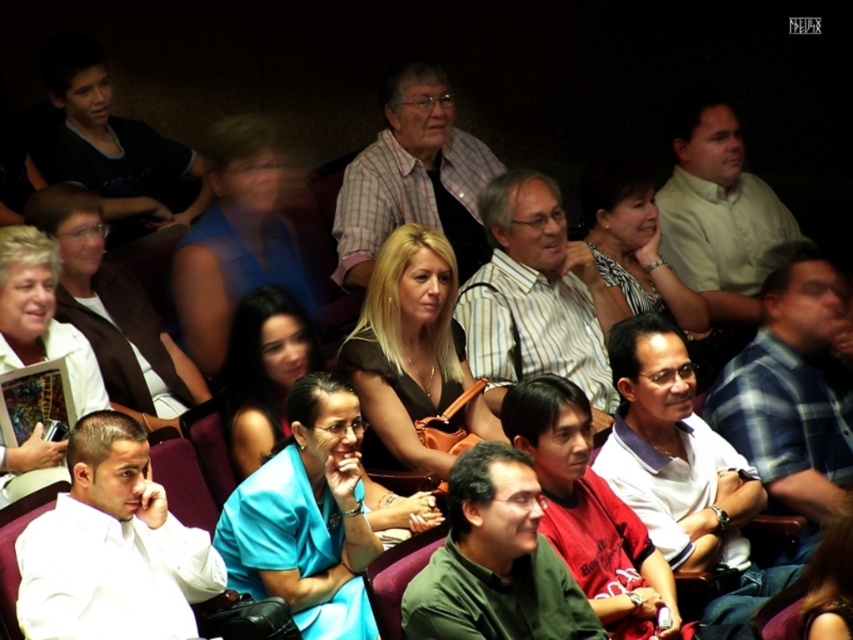
You are a photographer positioned at the back of the auditorium. You need to capture a photo that includes both the striped cotton shirt at center and the white paper at center. Given that your camera has a maximum focus range of 2.5 meters, will you be able to include both subjects in the same frame without moving closer?

The striped cotton shirt at center and white paper at center are 2.85 meters apart from each other, which exceeds the camera maximum focus range of 2.5 meters. Therefore, you cannot include both subjects in the same frame without moving closer.

You are an event photographer trying to capture a candid shot of the striped cotton shirt at center and the white paper at center. Since the lighting is dim, you need to adjust your camera settings. Which object should you focus on first to ensure proper exposure, considering their sizes?

The striped cotton shirt at center has a greater height compared to the white paper at center, so you should focus on the striped cotton shirt at center first to ensure proper exposure due to its larger size.